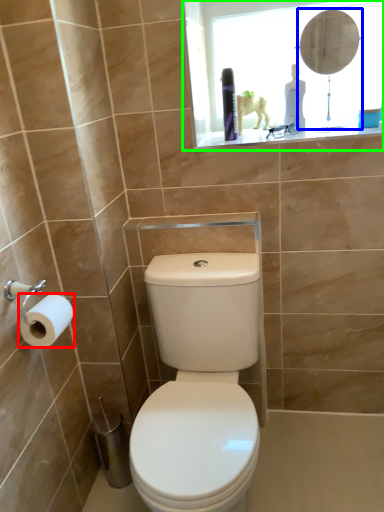
Question: Which object is the closest to the toilet paper (highlighted by a red box)? Choose among these: mirror (highlighted by a blue box) or medicine cabinet (highlighted by a green box).

Choices:
 (A) mirror
 (B) medicine cabinet

Answer: (B)